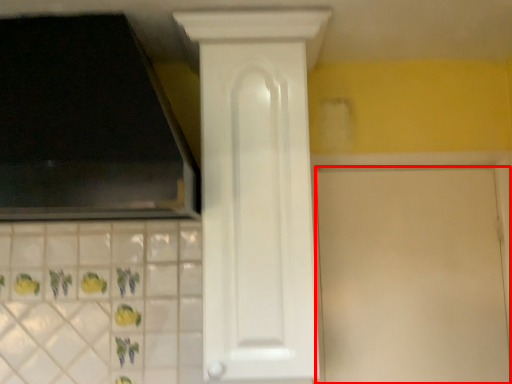
Question: Considering the relative positions of door (annotated by the red box) and door in the image provided, where is door (annotated by the red box) located with respect to the staircase?

Choices:
 (A) right
 (B) left

Answer: (A)